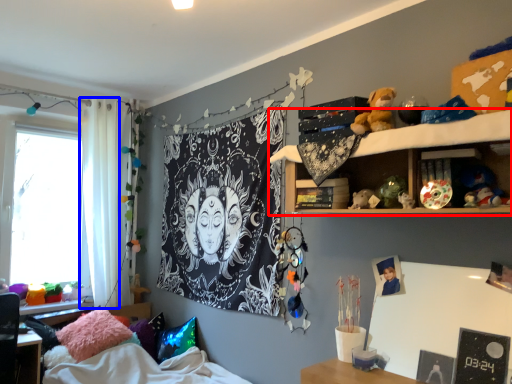
Question: Which object is closer to the camera taking this photo, shelf (highlighted by a red box) or curtain (highlighted by a blue box)?

Choices:
 (A) shelf
 (B) curtain

Answer: (A)